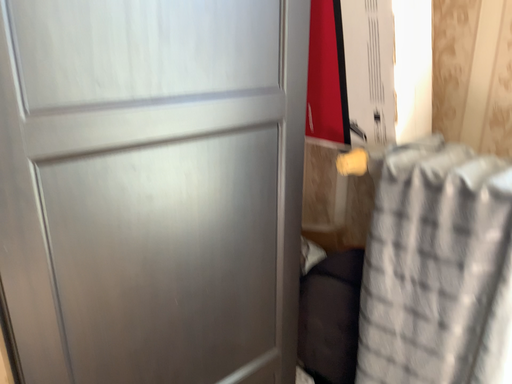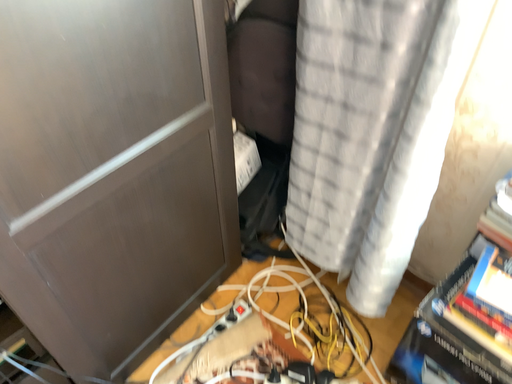
Question: Which way did the camera rotate in the video?

Choices:
 (A) rotated left
 (B) rotated right

Answer: (B)